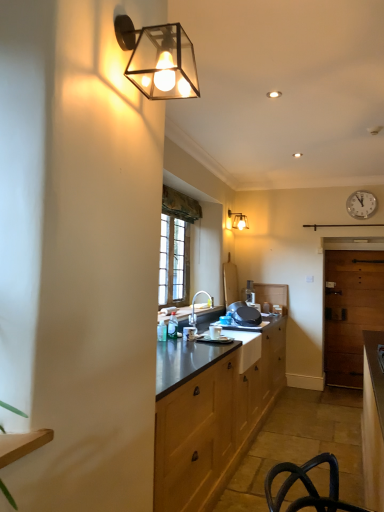
Question: Does wooden door at right turn towards matte glass wall sconce at upper center, which is the first lamp from back to front?

Choices:
 (A) no
 (B) yes

Answer: (A)

Question: Is wooden door at right facing away from matte glass wall sconce at upper center, which is counted as the first lamp, starting from the right?

Choices:
 (A) no
 (B) yes

Answer: (A)

Question: From a real-world perspective, is wooden door at right over matte glass wall sconce at upper center, which is the first lamp from back to front?

Choices:
 (A) no
 (B) yes

Answer: (A)

Question: From the image's perspective, is wooden door at right beneath matte glass wall sconce at upper center, which is counted as the first lamp, starting from the right?

Choices:
 (A) no
 (B) yes

Answer: (B)

Question: Can you confirm if wooden door at right is taller than matte glass wall sconce at upper center, which is counted as the first lamp, starting from the right?

Choices:
 (A) yes
 (B) no

Answer: (A)

Question: From the image's perspective, is wooden door at right on matte glass wall sconce at upper center, which is the first lamp from back to front?

Choices:
 (A) yes
 (B) no

Answer: (B)

Question: Considering the relative sizes of matte silver faucet at center and white plastic clock at upper right in the image provided, is matte silver faucet at center wider than white plastic clock at upper right?

Choices:
 (A) no
 (B) yes

Answer: (B)

Question: Is matte silver faucet at center oriented away from white plastic clock at upper right?

Choices:
 (A) no
 (B) yes

Answer: (A)

Question: Is matte silver faucet at center to the left of white plastic clock at upper right from the viewer's perspective?

Choices:
 (A) no
 (B) yes

Answer: (B)

Question: Is matte silver faucet at center facing towards white plastic clock at upper right?

Choices:
 (A) yes
 (B) no

Answer: (B)

Question: Is matte silver faucet at center smaller than white plastic clock at upper right?

Choices:
 (A) yes
 (B) no

Answer: (B)

Question: Can you confirm if matte silver faucet at center is taller than white plastic clock at upper right?

Choices:
 (A) yes
 (B) no

Answer: (A)

Question: From a real-world perspective, is matte silver faucet at center on top of matte black wall sconce at upper left, marked as the first lamp in a front-to-back arrangement?

Choices:
 (A) no
 (B) yes

Answer: (A)